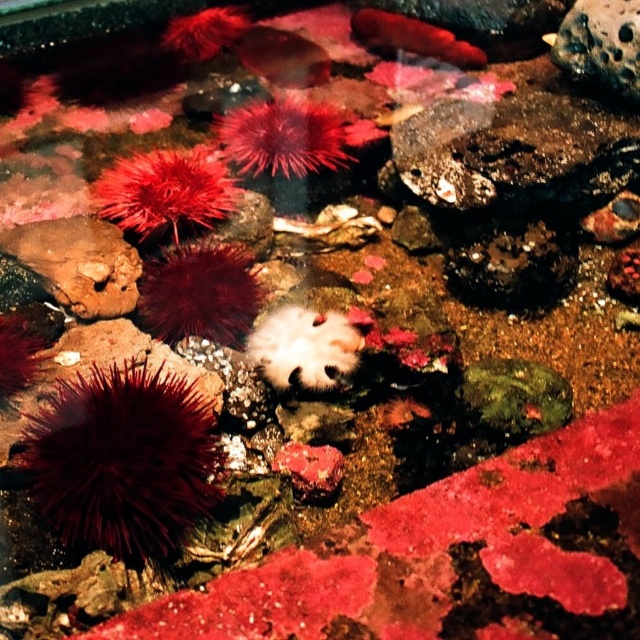
Is dark red spiky sea urchin at lower left shorter than red spiky sea urchin at center?

Incorrect, dark red spiky sea urchin at lower left's height does not fall short of red spiky sea urchin at center's.

Consider the image. Is dark red spiky sea urchin at lower left wider than red spiky sea urchin at center?

In fact, dark red spiky sea urchin at lower left might be narrower than red spiky sea urchin at center.

What do you see at coordinates (122, 460) in the screenshot?
I see `dark red spiky sea urchin at lower left` at bounding box center [122, 460].

This screenshot has height=640, width=640. In order to click on dark red spiky sea urchin at lower left in this screenshot , I will do `click(122, 460)`.

Does dark red spiky sea urchin at lower left have a lesser height compared to brown rough rock at left?

No.

Does point (102, 376) lie in front of point (58, 221)?

Yes, it is in front of point (58, 221).

Where is `dark red spiky sea urchin at lower left`? The width and height of the screenshot is (640, 640). dark red spiky sea urchin at lower left is located at coordinates (122, 460).

Which of these two, fuzzy red sea urchin at upper center or white fuzzy sea anemone at center, stands taller?

Standing taller between the two is fuzzy red sea urchin at upper center.

You are a GUI agent. You are given a task and a screenshot of the screen. Output one action in this format:
    pyautogui.click(x=<x>, y=<y>)
    Task: Click on the fuzzy red sea urchin at upper center
    This screenshot has height=640, width=640.
    Given the screenshot: What is the action you would take?
    pyautogui.click(x=284, y=136)

Find the location of `fuzzy red sea urchin at upper center`. fuzzy red sea urchin at upper center is located at coordinates (284, 136).

Identify the location of fuzzy red sea urchin at upper center. Image resolution: width=640 pixels, height=640 pixels. (284, 136).